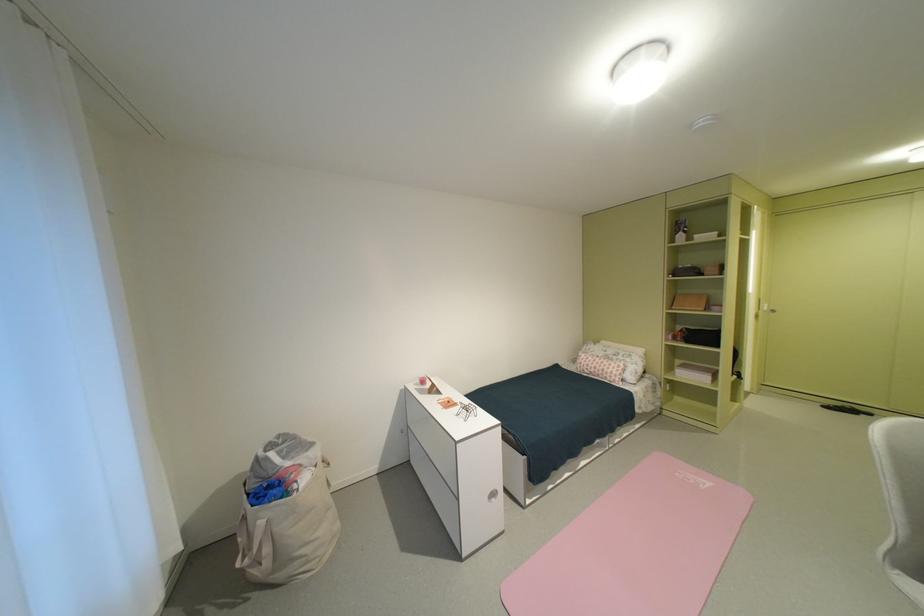
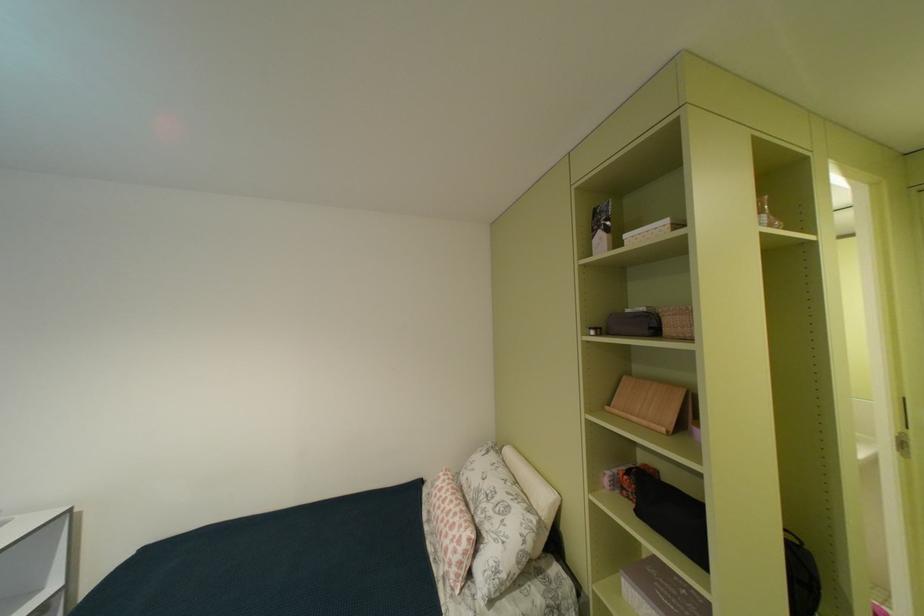
Locate, in the second image, the point that corresponds to the point at 613,355 in the first image.

(487, 487)